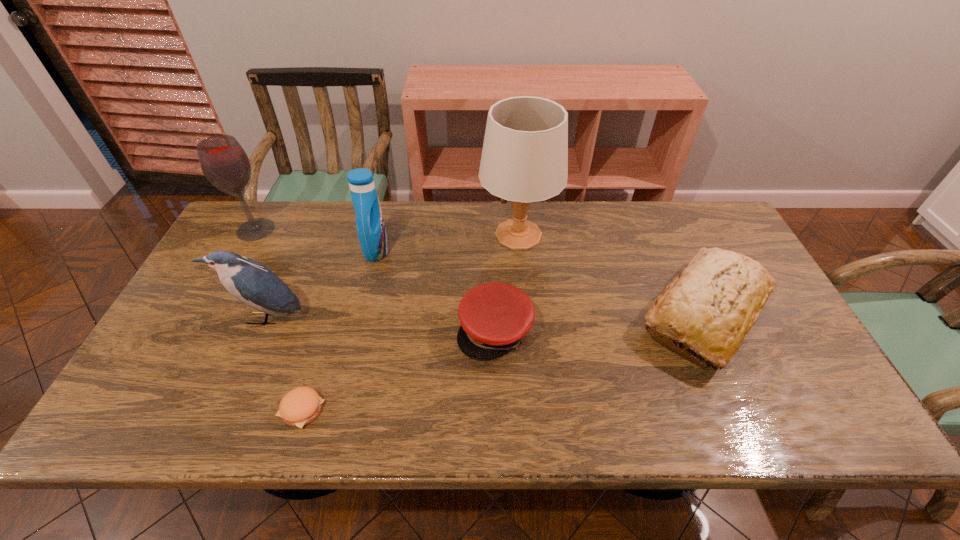
At what (x,y) coordinates should I click in order to perform the action: click on alcohol that is at the left edge. Please return your answer as a coordinate pair (x, y). Looking at the image, I should click on (223, 161).

At what (x,y) coordinates should I click in order to perform the action: click on bird at the left edge. Please return your answer as a coordinate pair (x, y). Looking at the image, I should click on (249, 281).

Identify the location of object positioned at the right edge. (711, 306).

Where is `object that is positioned at the far left corner`? The width and height of the screenshot is (960, 540). object that is positioned at the far left corner is located at coordinates (223, 161).

In order to click on vacant space at the far edge of the desktop in this screenshot , I will do `click(477, 236)`.

Identify the location of vacant space at the near edge. (496, 414).

Identify the location of free space at the left edge of the desktop. (216, 287).

Where is `vacant space at the right edge of the desktop`? vacant space at the right edge of the desktop is located at coordinates (764, 387).

Identify the location of blank area at the far left corner. (276, 203).

This screenshot has height=540, width=960. In order to click on vacant space at the far right corner of the desktop in this screenshot , I will do `click(728, 239)`.